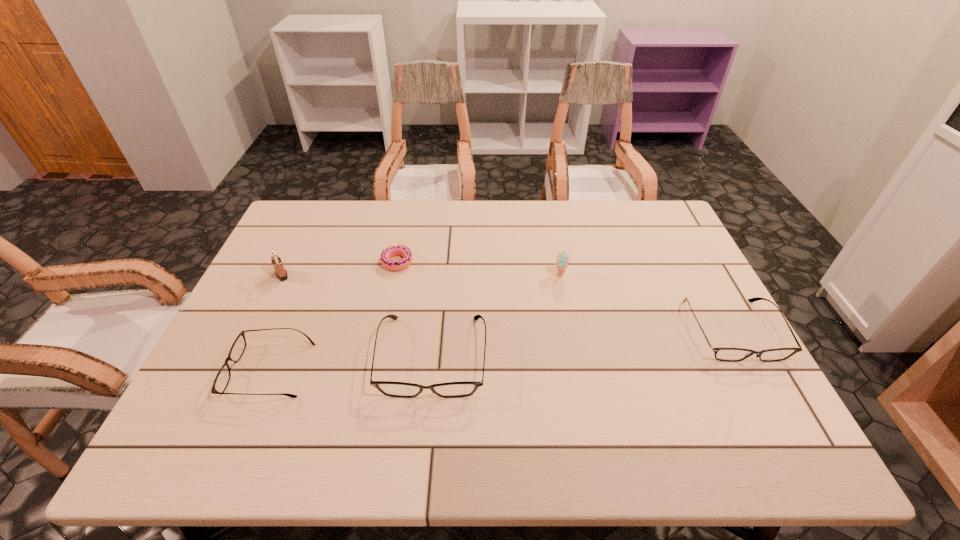
The height and width of the screenshot is (540, 960). Find the location of `vacant space located 0.180m on the right of the padlock`. vacant space located 0.180m on the right of the padlock is located at coordinates (351, 275).

Where is `spectacles present at the left edge`? Image resolution: width=960 pixels, height=540 pixels. spectacles present at the left edge is located at coordinates (222, 379).

The height and width of the screenshot is (540, 960). I want to click on padlock located in the left edge section of the desktop, so click(281, 273).

Locate an element on the screen. The width and height of the screenshot is (960, 540). object that is at the right edge is located at coordinates (726, 354).

Locate an element on the screen. The image size is (960, 540). object that is positioned at the near left corner is located at coordinates (222, 379).

In the image, there is a desktop. Find the location of `free space at the far edge`. free space at the far edge is located at coordinates (551, 211).

In the image, there is a desktop. Identify the location of free space at the near edge. (655, 390).

In order to click on free space at the left edge of the desktop in this screenshot , I will do point(297,302).

This screenshot has width=960, height=540. In the image, there is a desktop. What are the coordinates of `vacant space at the far left corner` in the screenshot? It's located at click(x=321, y=218).

In order to click on free space at the far right corner of the desktop in this screenshot , I will do `click(681, 242)`.